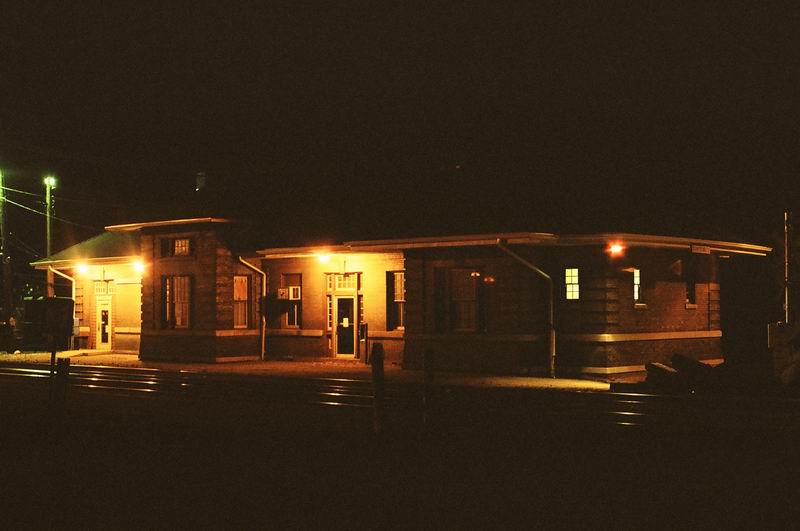
Locate an element on the screen. This screenshot has width=800, height=531. air conditioner is located at coordinates (289, 295).